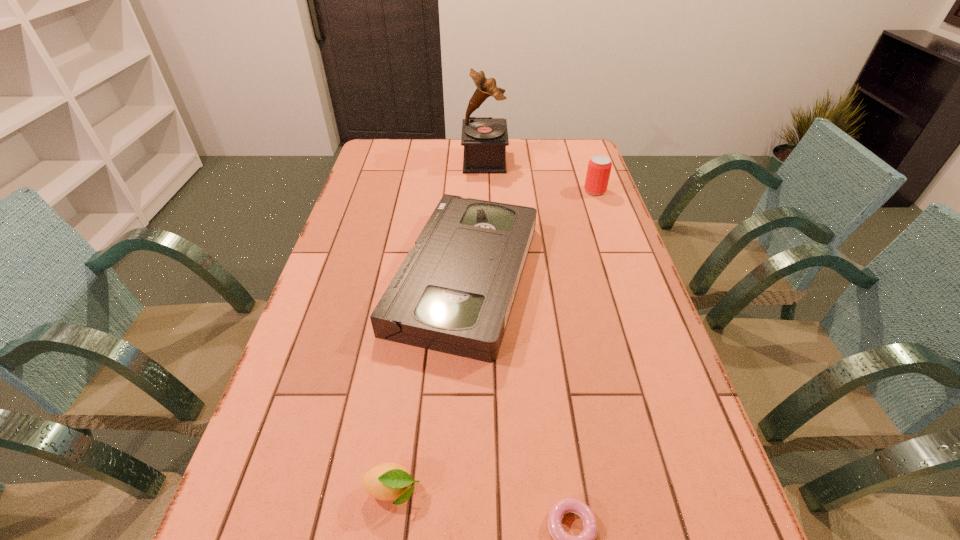
At what (x,y) coordinates should I click in order to perform the action: click on the third closest object relative to the third farthest object. Please return your answer as a coordinate pair (x, y). This screenshot has width=960, height=540. Looking at the image, I should click on (484, 139).

The image size is (960, 540). Identify the location of vacant region that satisfies the following two spatial constraints: 1. at the horn opening of the tallest object; 2. on the front side of the third nearest object. (487, 275).